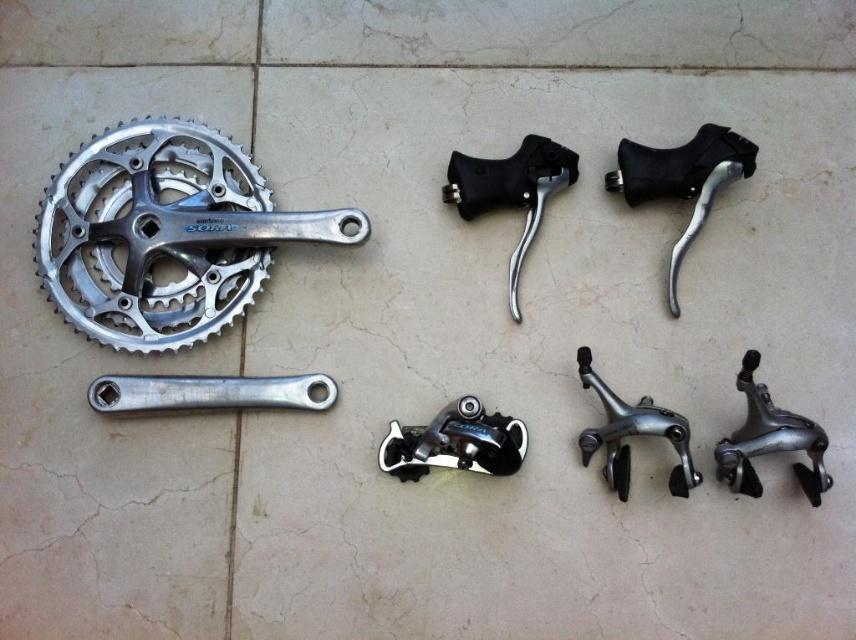
You are a technician inspecting the bicycle components. You notice two points marked on the image. One is at point (x=823, y=435) and the other is at point (x=670, y=488). Which point is closer to you?

Point (x=823, y=435) is closer to the viewer than point (x=670, y=488).

You are assembling a bicycle and need to place the silver metallic crank arm at lower left and the polished silver brake caliper at center. Which object is located above the other?

The silver metallic crank arm at lower left is positioned over the polished silver brake caliper at center, so it is above the other.

You are a mechanic working on a bike repair. You need to locate the brake lever for a specific repair task. The brake lever is positioned at a coordinate point. Which object from the scene corresponds to the brake lever located at point (770, 440)?

The brake lever located at point (770, 440) corresponds to the silver metallic brake at lower right.